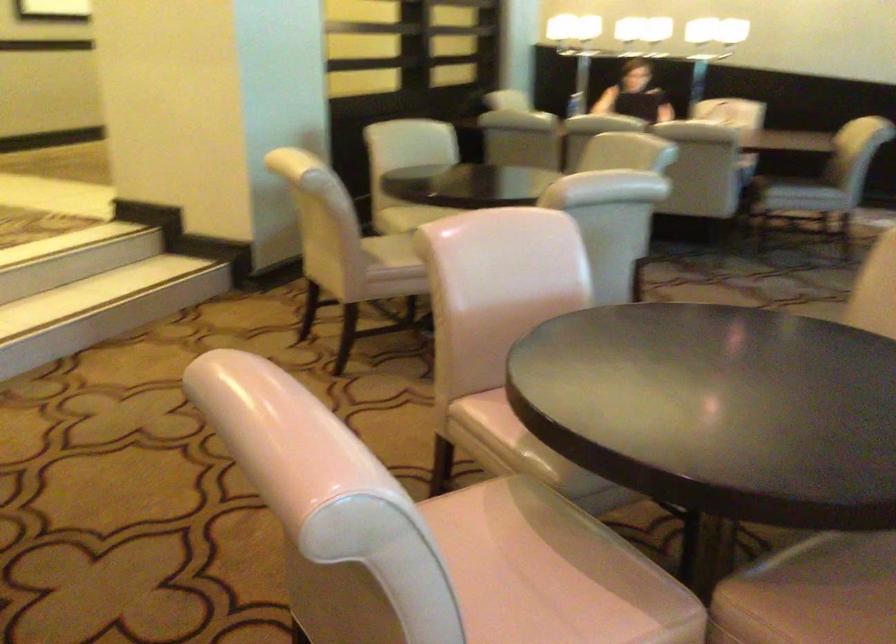
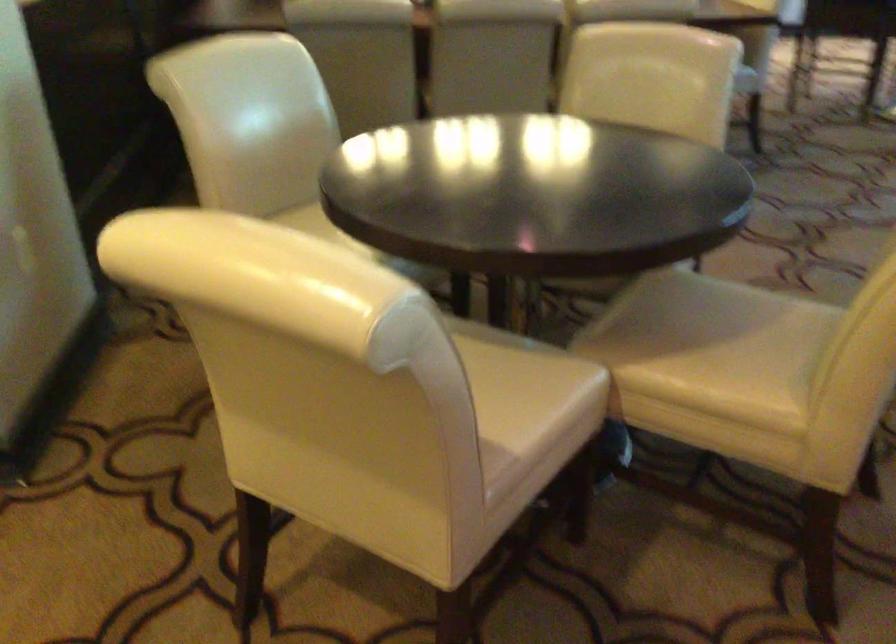
Which direction would the cameraman need to move to produce the second image?

The cameraman walked toward left, forward.